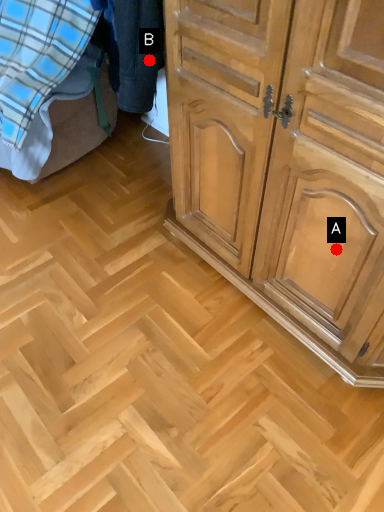
Question: Two points are circled on the image, labeled by A and B beside each circle. Among these points, which one is farthest from the camera?

Choices:
 (A) A is further
 (B) B is further

Answer: (B)